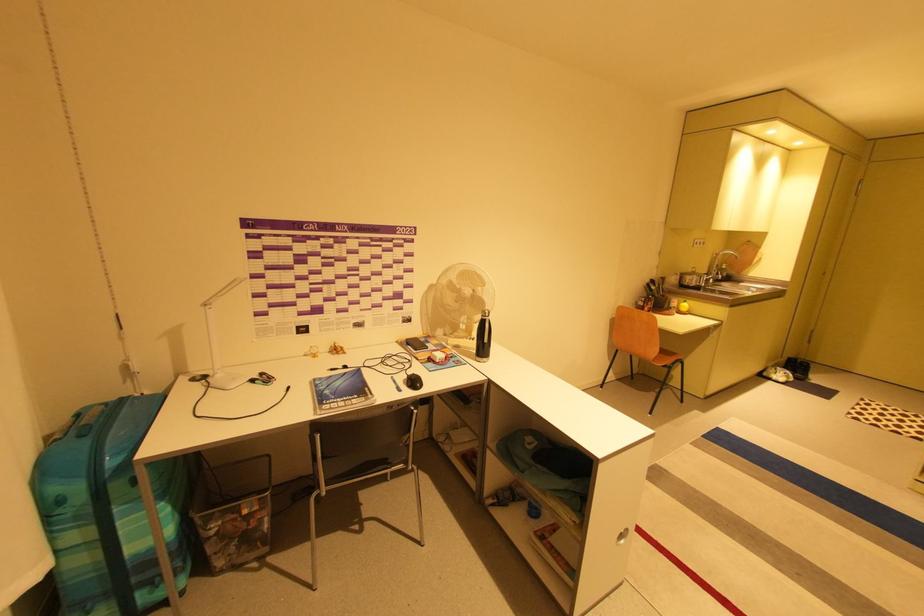
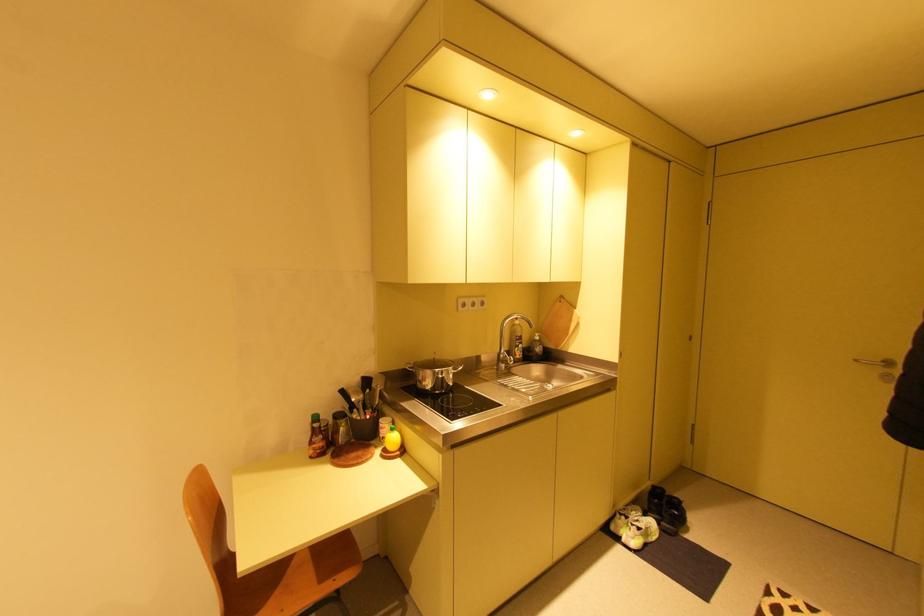
In the second image, find the point that corresponds to (803,375) in the first image.

(670, 524)